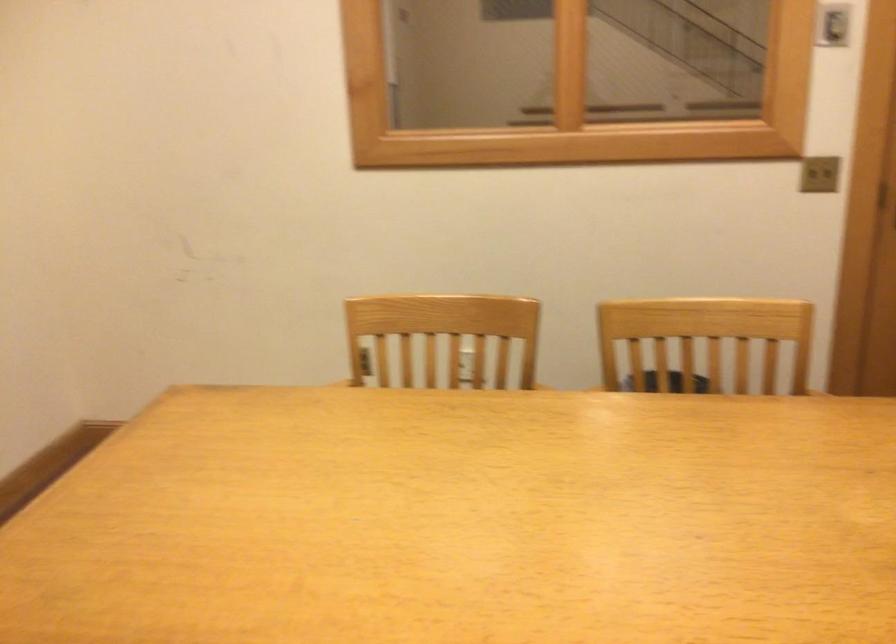
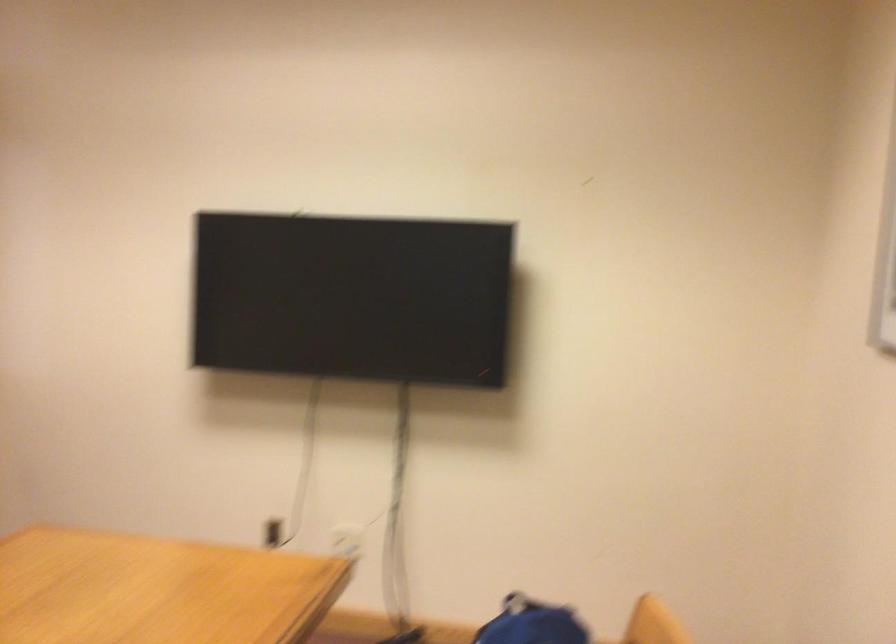
Question: The images are taken continuously from a first-person perspective. In which direction is your viewpoint rotating?

Choices:
 (A) Left
 (B) Right
 (C) Up
 (D) Down

Answer: (B)